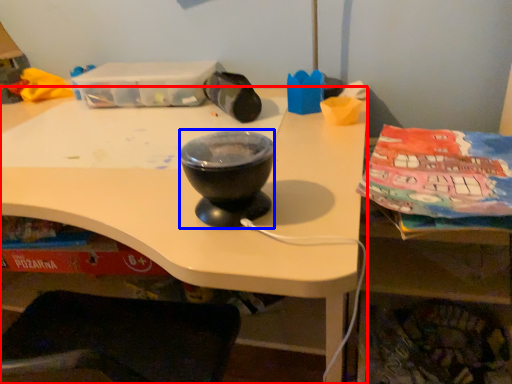
Question: Which object is further to the camera taking this photo, desk (highlighted by a red box) or basin (highlighted by a blue box)?

Choices:
 (A) desk
 (B) basin

Answer: (B)